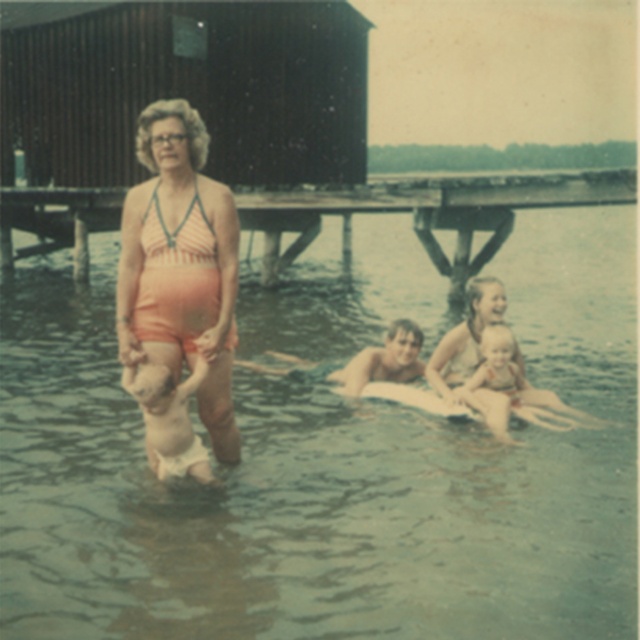
You are a photographer planning to take a family portrait. The wooden at upper center and the light pink fabric diaper at lower left are in the scene. Which object should you focus on first if you want to capture the tallest object in the frame?

The wooden at upper center is taller than the light pink fabric diaper at lower left, so you should focus on the wooden at upper center first to capture the tallest object in the frame.

You are a photographer trying to capture a family portrait. You need to position yourself so that both the wooden at upper center and the light pink fabric diaper at lower left are in the frame. Based on their positions, which object should you place on the right side of your camera viewfinder to ensure both are included?

You should position the wooden at upper center on the right side of your camera viewfinder because it is to the right of the light pink fabric diaper at lower left, ensuring both are included in the frame.